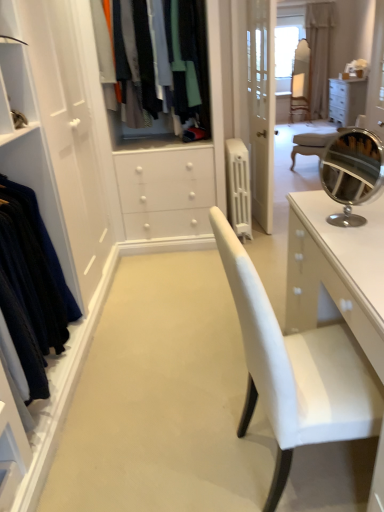
This screenshot has width=384, height=512. I want to click on white plastic radiator at center, so click(238, 187).

Find the location of `matte fabric clothes at center, the second clothing from the front`. matte fabric clothes at center, the second clothing from the front is located at coordinates (193, 63).

The height and width of the screenshot is (512, 384). What are the coordinates of `light beige fabric armchair at center` in the screenshot? It's located at (300, 95).

Locate an element on the screen. white plastic radiator at center is located at coordinates (238, 187).

Which is closer, (42, 341) or (298, 81)?

Positioned in front is point (42, 341).

From the picture: How many degrees apart are the facing directions of velvet dark blue dress at left, arranged as the second clothing when viewed from the right, and light beige fabric armchair at center?

The facing directions of velvet dark blue dress at left, arranged as the second clothing when viewed from the right, and light beige fabric armchair at center are 117 degrees apart.

Between velvet dark blue dress at left, which is the 1th clothing from bottom to top, and light beige fabric armchair at center, which one has smaller width?

Thinner between the two is light beige fabric armchair at center.

Is matte fabric clothes at center, which appears as the 2th clothing when viewed from the left, a part of light beige fabric armchair at center?

No.

Is light beige fabric armchair at center in front of or behind matte fabric clothes at center, which ranks as the second clothing in bottom-to-top order, in the image?

Visually, light beige fabric armchair at center is located behind matte fabric clothes at center, which ranks as the second clothing in bottom-to-top order.

Which object is wider, light beige fabric armchair at center or matte fabric clothes at center, which ranks as the second clothing in bottom-to-top order?

Wider between the two is matte fabric clothes at center, which ranks as the second clothing in bottom-to-top order.

Is light beige fabric armchair at center facing away from matte fabric clothes at center, which ranks as the second clothing in bottom-to-top order?

light beige fabric armchair at center does not have its back to matte fabric clothes at center, which ranks as the second clothing in bottom-to-top order.

Which is in front, velvet dark blue dress at left, which is counted as the 1th clothing, starting from the front, or white plastic radiator at center?

Positioned in front is velvet dark blue dress at left, which is counted as the 1th clothing, starting from the front.

Locate an element on the screen. Image resolution: width=384 pixels, height=512 pixels. radiator that is on the right side of velvet dark blue dress at left, arranged as the second clothing when viewed from the right is located at coordinates (238, 187).

Based on the photo, from a real-world perspective, is velvet dark blue dress at left, which is the 1th clothing from bottom to top, positioned above or below white plastic radiator at center?

velvet dark blue dress at left, which is the 1th clothing from bottom to top, is above white plastic radiator at center.

Which is behind, point (21, 313) or point (232, 215)?

Positioned behind is point (232, 215).

Does beige fabric curtain at upper right have a greater width compared to white plastic radiator at center?

Incorrect, the width of beige fabric curtain at upper right does not surpass that of white plastic radiator at center.

Does point (321, 58) come behind point (249, 174)?

Yes, point (321, 58) is farther from viewer.

From the image's perspective, between beige fabric curtain at upper right and white plastic radiator at center, who is located below?

white plastic radiator at center is shown below in the image.

Considering the relative sizes of beige fabric curtain at upper right and white plastic radiator at center in the image provided, is beige fabric curtain at upper right shorter than white plastic radiator at center?

In fact, beige fabric curtain at upper right may be taller than white plastic radiator at center.

Considering the sizes of objects matte fabric clothes at center, which ranks as the second clothing in bottom-to-top order, and velvet dark blue dress at left, which is counted as the 1th clothing, starting from the front, in the image provided, who is wider, matte fabric clothes at center, which ranks as the second clothing in bottom-to-top order, or velvet dark blue dress at left, which is counted as the 1th clothing, starting from the front,?

With larger width is matte fabric clothes at center, which ranks as the second clothing in bottom-to-top order.

Is matte fabric clothes at center, positioned as the 1th clothing in back-to-front order, positioned behind velvet dark blue dress at left, arranged as the second clothing when viewed from the right?

Yes, matte fabric clothes at center, positioned as the 1th clothing in back-to-front order, is behind velvet dark blue dress at left, arranged as the second clothing when viewed from the right.

In the scene shown: From a real-world perspective, which object stands above the other?

matte fabric clothes at center, which ranks as the second clothing in bottom-to-top order, from a real-world perspective.

Between light beige fabric armchair at center and beige fabric curtain at upper right, which one has less height?

light beige fabric armchair at center.

Measure the distance from light beige fabric armchair at center to beige fabric curtain at upper right.

light beige fabric armchair at center is 50.67 centimeters from beige fabric curtain at upper right.

Considering the positions of points (308, 89) and (315, 38), is point (308, 89) farther from camera compared to point (315, 38)?

Yes, it is.

Is light beige fabric armchair at center closer to the viewer compared to beige fabric curtain at upper right?

Yes, it is in front of beige fabric curtain at upper right.

Considering their positions, is velvet dark blue dress at left, which is the 1th clothing from bottom to top, located in front of or behind matte fabric clothes at center, the first clothing viewed from the right?

In the image, velvet dark blue dress at left, which is the 1th clothing from bottom to top, appears in front of matte fabric clothes at center, the first clothing viewed from the right.

Looking at this image, which object is positioned more to the left, velvet dark blue dress at left, which is counted as the 1th clothing, starting from the front, or matte fabric clothes at center, which appears as the 2th clothing when viewed from the left?

velvet dark blue dress at left, which is counted as the 1th clothing, starting from the front.

Which is farther, [26,309] or [179,87]?

The point [179,87] is more distant.

Can you tell me how much velvet dark blue dress at left, which is the 1th clothing from bottom to top, and matte fabric clothes at center, which appears as the 2th clothing when viewed from the left, differ in facing direction?

The facing directions of velvet dark blue dress at left, which is the 1th clothing from bottom to top, and matte fabric clothes at center, which appears as the 2th clothing when viewed from the left, are 87.5 degrees apart.

You are a GUI agent. You are given a task and a screenshot of the screen. Output one action in this format:
    pyautogui.click(x=<x>, y=<y>)
    Task: Click on the armchair above the velvet dark blue dress at left, the 1th clothing when ordered from left to right (from the image's perspective)
    
    Given the screenshot: What is the action you would take?
    point(300,95)

Locate an element on the screen. Image resolution: width=384 pixels, height=512 pixels. armchair located behind the matte fabric clothes at center, positioned as the 1th clothing in back-to-front order is located at coordinates (300, 95).

Based on the photo, considering their positions, is velvet dark blue dress at left, which is counted as the 1th clothing, starting from the front, positioned further to matte fabric clothes at center, which ranks as the second clothing in bottom-to-top order, than beige fabric curtain at upper right?

Based on the image, beige fabric curtain at upper right appears to be further to matte fabric clothes at center, which ranks as the second clothing in bottom-to-top order.

Considering their positions, is velvet dark blue dress at left, which is counted as the 1th clothing, starting from the front, positioned closer to matte fabric clothes at center, which appears as the 2th clothing when viewed from the left, than white plastic radiator at center?

Among the two, white plastic radiator at center is located nearer to matte fabric clothes at center, which appears as the 2th clothing when viewed from the left.

Which object lies nearer to the anchor point velvet dark blue dress at left, the second clothing when ordered from back to front, beige fabric curtain at upper right or matte fabric clothes at center, the second clothing from the front?

matte fabric clothes at center, the second clothing from the front, is positioned closer to the anchor velvet dark blue dress at left, the second clothing when ordered from back to front.

From the image, which object appears to be farther from beige fabric curtain at upper right, matte fabric clothes at center, which appears as the 2th clothing when viewed from the left, or velvet dark blue dress at left, arranged as the second clothing when viewed from the right?

velvet dark blue dress at left, arranged as the second clothing when viewed from the right, is further to beige fabric curtain at upper right.

When comparing their distances from velvet dark blue dress at left, the 1th clothing when ordered from left to right, does matte fabric clothes at center, which appears as the 2th clothing when viewed from the left, or white plastic radiator at center seem further?

Among the two, white plastic radiator at center is located further to velvet dark blue dress at left, the 1th clothing when ordered from left to right.

Estimate the real-world distances between objects in this image. Which object is further from white plastic radiator at center, velvet dark blue dress at left, which is counted as the 1th clothing, starting from the front, or beige fabric curtain at upper right?

Among the two, beige fabric curtain at upper right is located further to white plastic radiator at center.

Estimate the real-world distances between objects in this image. Which object is closer to matte fabric clothes at center, the second clothing from the front, white plastic radiator at center or velvet dark blue dress at left, which is counted as the 1th clothing, starting from the front?

white plastic radiator at center is positioned closer to the anchor matte fabric clothes at center, the second clothing from the front.

Based on their spatial positions, is beige fabric curtain at upper right or light beige fabric armchair at center closer to white plastic radiator at center?

beige fabric curtain at upper right lies closer to white plastic radiator at center than the other object.

Locate an element on the screen. clothing between velvet dark blue dress at left, the 1th clothing when ordered from left to right, and light beige fabric armchair at center, along the z-axis is located at coordinates (193, 63).

Where is `clothing between velvet dark blue dress at left, which is the 1th clothing from bottom to top, and beige fabric curtain at upper right from front to back`? clothing between velvet dark blue dress at left, which is the 1th clothing from bottom to top, and beige fabric curtain at upper right from front to back is located at coordinates (193, 63).

At what (x,y) coordinates should I click in order to perform the action: click on armchair between velvet dark blue dress at left, the 1th clothing when ordered from left to right, and beige fabric curtain at upper right, along the z-axis. Please return your answer as a coordinate pair (x, y). Looking at the image, I should click on (300, 95).

Image resolution: width=384 pixels, height=512 pixels. In order to click on armchair located between matte fabric clothes at center, which appears as the 2th clothing when viewed from the left, and beige fabric curtain at upper right in the depth direction in this screenshot , I will do `click(300, 95)`.